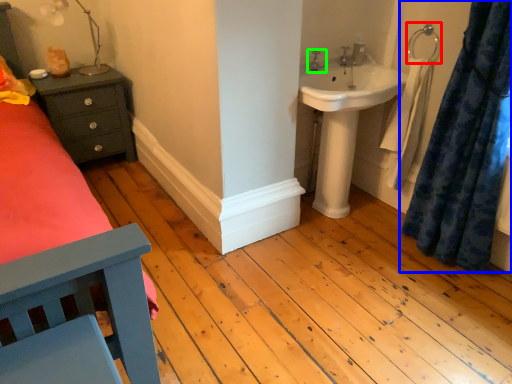
Question: Which object is positioned closest to towel bar (highlighted by a red box)? Select from curtain (highlighted by a blue box) and tap (highlighted by a green box).

Choices:
 (A) curtain
 (B) tap

Answer: (B)